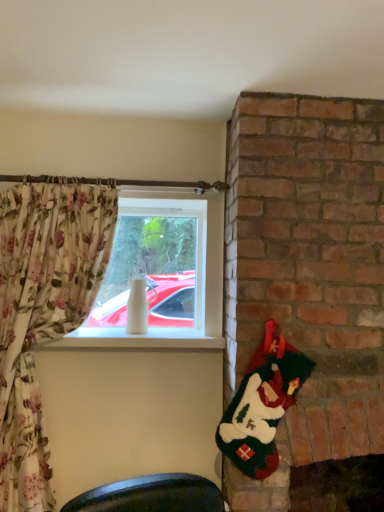
Question: Visually, is fuzzy green santa at right positioned to the left or to the right of white glossy vase at center?

Choices:
 (A) left
 (B) right

Answer: (B)

Question: In terms of width, does fuzzy green santa at right look wider or thinner when compared to white glossy vase at center?

Choices:
 (A) wide
 (B) thin

Answer: (B)

Question: Based on their sizes in the image, would you say fuzzy green santa at right is bigger or smaller than white glossy vase at center?

Choices:
 (A) big
 (B) small

Answer: (B)

Question: Is white glossy vase at center situated inside fuzzy green santa at right or outside?

Choices:
 (A) outside
 (B) inside

Answer: (A)

Question: From the image's perspective, is white glossy vase at center positioned above or below fuzzy green santa at right?

Choices:
 (A) below
 (B) above

Answer: (B)

Question: Based on their positions, is white glossy vase at center located to the left or right of fuzzy green santa at right?

Choices:
 (A) right
 (B) left

Answer: (B)

Question: From a real-world perspective, is white glossy vase at center above or below fuzzy green santa at right?

Choices:
 (A) below
 (B) above

Answer: (B)